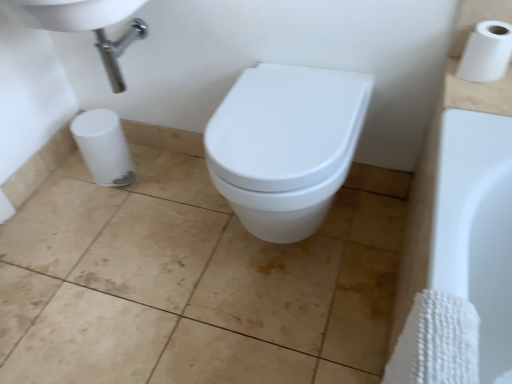
Question: Is white glossy sink at upper left a part of white glossy toilet at center?

Choices:
 (A) yes
 (B) no

Answer: (B)

Question: Does white glossy toilet at center turn towards white glossy sink at upper left?

Choices:
 (A) no
 (B) yes

Answer: (A)

Question: Is white glossy toilet at center wider than white glossy sink at upper left?

Choices:
 (A) no
 (B) yes

Answer: (B)

Question: Considering the relative sizes of white glossy toilet at center and white glossy sink at upper left in the image provided, is white glossy toilet at center shorter than white glossy sink at upper left?

Choices:
 (A) no
 (B) yes

Answer: (A)

Question: Is white glossy toilet at center positioned behind white glossy sink at upper left?

Choices:
 (A) no
 (B) yes

Answer: (A)

Question: Considering the positions of white glossy toilet at center and white glossy sink at upper left in the image, is white glossy toilet at center wider or thinner than white glossy sink at upper left?

Choices:
 (A) wide
 (B) thin

Answer: (A)

Question: From a real-world perspective, is white glossy toilet at center positioned above or below white glossy sink at upper left?

Choices:
 (A) above
 (B) below

Answer: (B)

Question: Considering their positions, is white glossy toilet at center located in front of or behind white glossy sink at upper left?

Choices:
 (A) behind
 (B) front

Answer: (B)

Question: Based on their positions, is white glossy toilet at center located to the left or right of white glossy sink at upper left?

Choices:
 (A) right
 (B) left

Answer: (A)

Question: Is white glossy sink at upper left bigger or smaller than white glossy toilet at center?

Choices:
 (A) big
 (B) small

Answer: (B)

Question: Is white glossy sink at upper left to the left or to the right of white glossy toilet at center in the image?

Choices:
 (A) left
 (B) right

Answer: (A)

Question: From a real-world perspective, relative to white glossy toilet at center, is white glossy sink at upper left vertically above or below?

Choices:
 (A) below
 (B) above

Answer: (B)

Question: Looking at their shapes, would you say white glossy sink at upper left is wider or thinner than white glossy toilet at center?

Choices:
 (A) wide
 (B) thin

Answer: (B)

Question: From the image's perspective, is beige ceramic tile at center above or below white matte toilet paper at upper right?

Choices:
 (A) above
 (B) below

Answer: (B)

Question: Is beige ceramic tile at center wider or thinner than white matte toilet paper at upper right?

Choices:
 (A) thin
 (B) wide

Answer: (B)